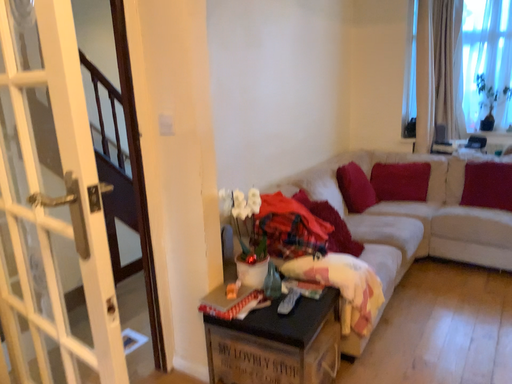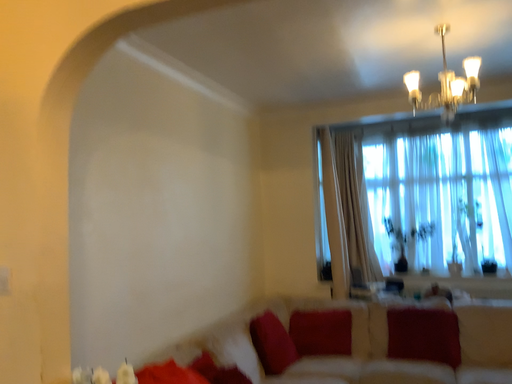
Question: How did the camera likely rotate when shooting the video?

Choices:
 (A) rotated upward
 (B) rotated downward

Answer: (A)